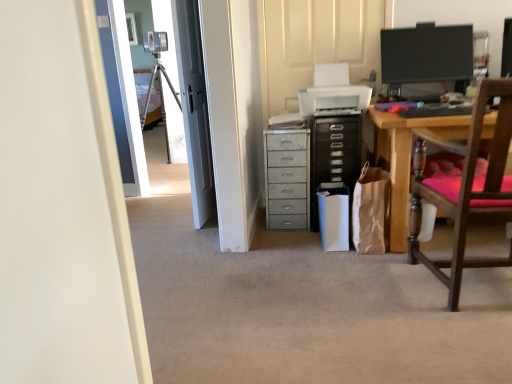
Where is `vacant location below brown paper bag at lower right (from a real-world perspective)`? The height and width of the screenshot is (384, 512). vacant location below brown paper bag at lower right (from a real-world perspective) is located at coordinates (366, 256).